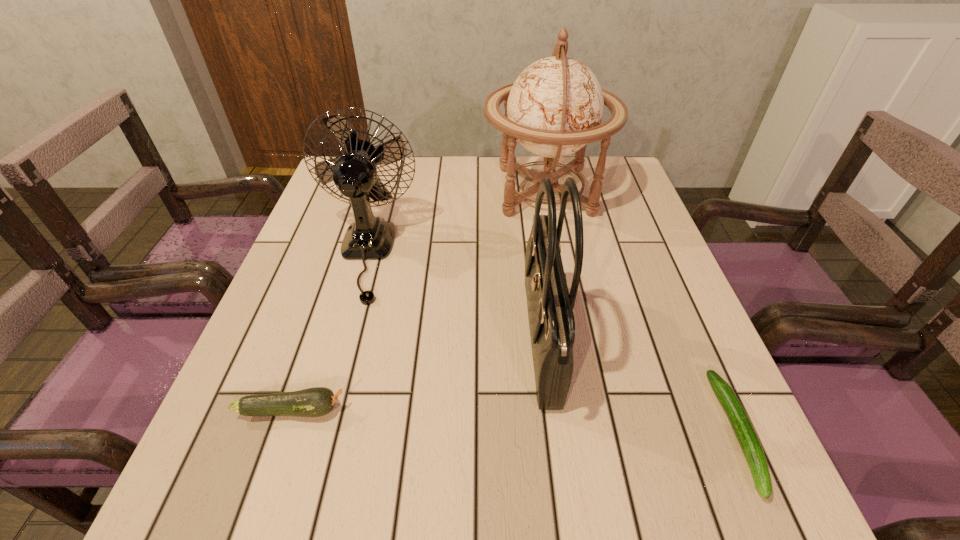
This screenshot has height=540, width=960. I want to click on globe, so click(x=555, y=107).

I want to click on handbag, so click(550, 306).

You are a GUI agent. You are given a task and a screenshot of the screen. Output one action in this format:
    pyautogui.click(x=<x>, y=<y>)
    Task: Click on the fan
    The image size is (960, 540).
    Given the screenshot: What is the action you would take?
    pyautogui.click(x=354, y=173)

This screenshot has height=540, width=960. Identify the location of the left zucchini. (318, 401).

Find the location of a particular element. The height and width of the screenshot is (540, 960). the second shortest object is located at coordinates (318, 401).

You are a GUI agent. You are given a task and a screenshot of the screen. Output one action in this format:
    pyautogui.click(x=<x>, y=<y>)
    Task: Click on the shorter zucchini
    This screenshot has width=960, height=540.
    Given the screenshot: What is the action you would take?
    pyautogui.click(x=744, y=431)

The width and height of the screenshot is (960, 540). I want to click on the rightmost object, so click(x=744, y=431).

Where is `free location located 0.340m at the front of the globe showing Africa`? This screenshot has width=960, height=540. free location located 0.340m at the front of the globe showing Africa is located at coordinates (361, 191).

In order to click on free location located at the front of the globe showing Africa in this screenshot , I will do 437,191.

Locate an element on the screen. free space located at the front of the globe showing Africa is located at coordinates (375, 191).